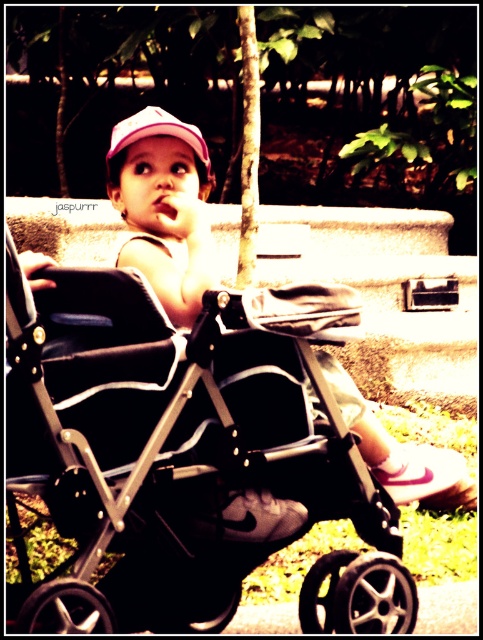
You are a delivery person trying to navigate a narrow path that is 1.2 meters wide. You see the black matte baby carriage at center and the pink fabric cap at upper center in your way. Can you pass through the path without touching either object?

The black matte baby carriage at center might be wider than pink fabric cap at upper center. Since the path is 1.2 meters wide, it is uncertain if the black matte baby carriage at center can fit through without touching the sides. The pink fabric cap at upper center is smaller, but its positioning might not block the path. However, without knowing the exact width of the carriage, it is difficult to determine if the delivery person can pass safely.

You are a photographer trying to capture a candid shot of the child in the black stroller. You notice the pink fabric toddler at center and the pink fabric cap at upper center. Which object is positioned further to the right from your viewpoint?

The pink fabric toddler at center is positioned further to the right compared to the pink fabric cap at upper center.